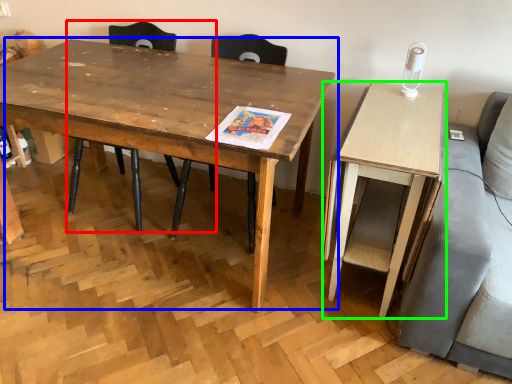
Question: Which object is the farthest from chair (highlighted by a red box)? Choose among these: coffee table (highlighted by a blue box) or desk (highlighted by a green box).

Choices:
 (A) coffee table
 (B) desk

Answer: (B)